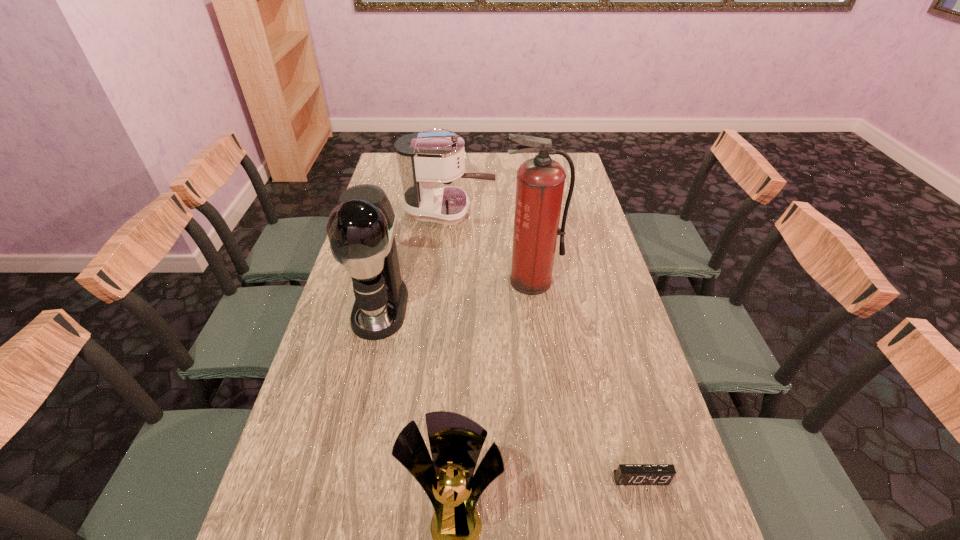
I want to click on vacant point located on the front-facing side of the farther coffee maker, so click(523, 211).

This screenshot has height=540, width=960. I want to click on free point located 0.070m on the front-facing side of the rightmost object, so click(x=652, y=521).

Find the location of a particular element. The height and width of the screenshot is (540, 960). object located in the right edge section of the desktop is located at coordinates (626, 474).

Find the location of `vacant region at the far edge of the desktop`. vacant region at the far edge of the desktop is located at coordinates (518, 168).

In the image, there is a desktop. Identify the location of free space at the left edge. click(374, 366).

This screenshot has height=540, width=960. I want to click on free space at the right edge of the desktop, so click(x=627, y=503).

The width and height of the screenshot is (960, 540). Find the location of `free space at the far right corner`. free space at the far right corner is located at coordinates (579, 174).

Identify the location of vacant space in between the shortest object and the nearer coffee maker. (511, 393).

Find the location of a particular element. The width and height of the screenshot is (960, 540). free space that is in between the fire extinguisher and the farthest object is located at coordinates (491, 246).

Identify the location of empty space that is in between the farthest object and the fourth object from left to right. The height and width of the screenshot is (540, 960). (491, 246).